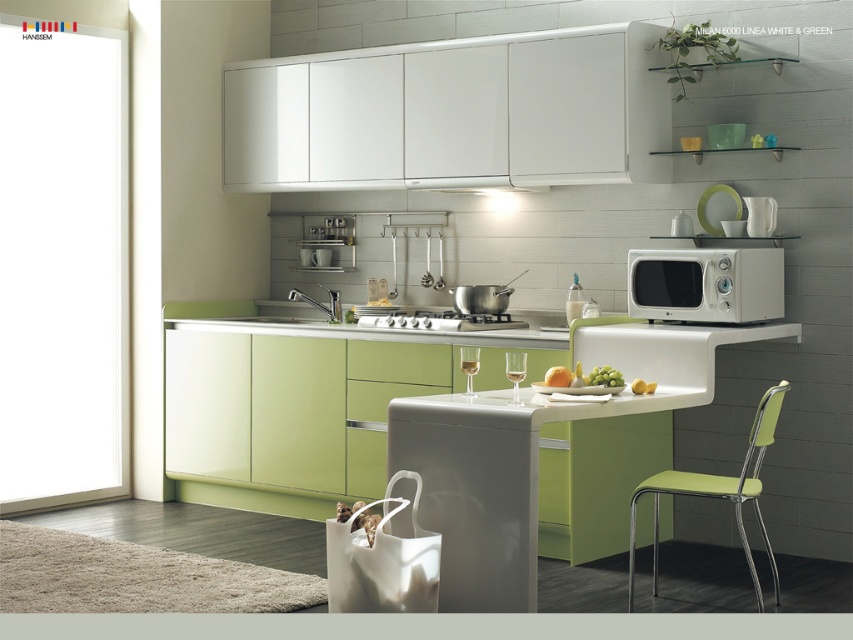
Question: Does green plastic chair at lower right come in front of stainless steel gas stove at center?

Choices:
 (A) yes
 (B) no

Answer: (A)

Question: Which point is farther to the camera?

Choices:
 (A) green matte apple at center
 (B) stainless steel gas stove at center

Answer: (B)

Question: Is white matte microwave at upper right to the left of green plastic chair at lower right from the viewer's perspective?

Choices:
 (A) yes
 (B) no

Answer: (B)

Question: Does white matte microwave at upper right appear over green plastic chair at lower right?

Choices:
 (A) yes
 (B) no

Answer: (A)

Question: Among these objects, which one is nearest to the camera?

Choices:
 (A) green plastic chair at lower right
 (B) green matte apple at center
 (C) white matte microwave at upper right

Answer: (A)

Question: Which point is farther to the camera?

Choices:
 (A) (643, 276)
 (B) (386, 324)
 (C) (550, 371)

Answer: (B)